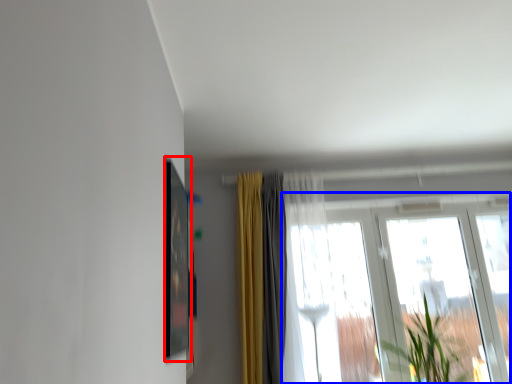
Question: Which object is further to the camera taking this photo, picture frame (highlighted by a red box) or window (highlighted by a blue box)?

Choices:
 (A) picture frame
 (B) window

Answer: (B)